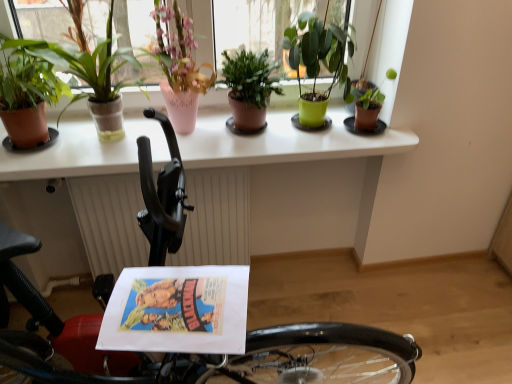
Question: Is green matte plant at center, the 4th houseplant positioned from the left, next to pink ceramic vase at upper left, the third houseplant positioned from the left?

Choices:
 (A) no
 (B) yes

Answer: (A)

Question: Is green matte plant at center, the 4th houseplant positioned from the left, bigger than pink ceramic vase at upper left, which appears as the 4th houseplant when viewed from the right?

Choices:
 (A) yes
 (B) no

Answer: (B)

Question: From a real-world perspective, is green matte plant at center, arranged as the 3th houseplant when viewed from the right, under pink ceramic vase at upper left, the third houseplant positioned from the left?

Choices:
 (A) yes
 (B) no

Answer: (A)

Question: Can pink ceramic vase at upper left, which appears as the 4th houseplant when viewed from the right, be found inside green matte plant at center, the 4th houseplant positioned from the left?

Choices:
 (A) yes
 (B) no

Answer: (B)

Question: Is green matte plant at center, arranged as the 3th houseplant when viewed from the right, outside of pink ceramic vase at upper left, which appears as the 4th houseplant when viewed from the right?

Choices:
 (A) yes
 (B) no

Answer: (A)

Question: Is green matte plant at center, arranged as the 3th houseplant when viewed from the right, turned away from pink ceramic vase at upper left, which appears as the 4th houseplant when viewed from the right?

Choices:
 (A) no
 (B) yes

Answer: (A)

Question: Is black rubber bicycle at lower left further to camera compared to terracotta pot plant at left, which appears as the 2th houseplant when viewed from the left?

Choices:
 (A) no
 (B) yes

Answer: (A)

Question: From a real-world perspective, is black rubber bicycle at lower left physically above terracotta pot plant at left, the 5th houseplant when ordered from right to left?

Choices:
 (A) yes
 (B) no

Answer: (B)

Question: Is black rubber bicycle at lower left thinner than terracotta pot plant at left, the 5th houseplant when ordered from right to left?

Choices:
 (A) no
 (B) yes

Answer: (A)

Question: Considering the relative sizes of black rubber bicycle at lower left and terracotta pot plant at left, which appears as the 2th houseplant when viewed from the left, in the image provided, is black rubber bicycle at lower left smaller than terracotta pot plant at left, which appears as the 2th houseplant when viewed from the left,?

Choices:
 (A) yes
 (B) no

Answer: (B)

Question: Is black rubber bicycle at lower left next to terracotta pot plant at left, the 5th houseplant when ordered from right to left, and touching it?

Choices:
 (A) yes
 (B) no

Answer: (B)

Question: Is black rubber bicycle at lower left positioned far away from terracotta pot plant at left, which appears as the 2th houseplant when viewed from the left?

Choices:
 (A) yes
 (B) no

Answer: (B)

Question: Considering the relative sizes of terracotta pot plant at left, which appears as the 2th houseplant when viewed from the left, and green matte plant at center, arranged as the 3th houseplant when viewed from the right, in the image provided, is terracotta pot plant at left, which appears as the 2th houseplant when viewed from the left, thinner than green matte plant at center, arranged as the 3th houseplant when viewed from the right,?

Choices:
 (A) no
 (B) yes

Answer: (A)